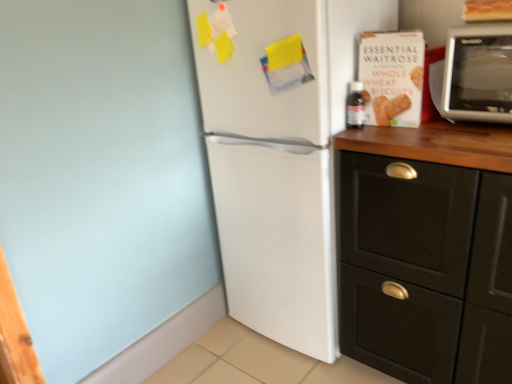
From the picture: What is the approximate width of silver metallic microwave at upper right?

It is 43.12 centimeters.

Where is `white matte refrigerator at center`? white matte refrigerator at center is located at coordinates (279, 159).

How distant is silver metallic microwave at upper right from white matte refrigerator at center?

A distance of 21.13 inches exists between silver metallic microwave at upper right and white matte refrigerator at center.

Is silver metallic microwave at upper right positioned beyond the bounds of white matte refrigerator at center?

Yes, silver metallic microwave at upper right is located beyond the bounds of white matte refrigerator at center.

How different are the orientations of silver metallic microwave at upper right and white matte refrigerator at center in degrees?

2.71 degrees.

Considering the sizes of objects silver metallic microwave at upper right and white matte refrigerator at center in the image provided, who is shorter, silver metallic microwave at upper right or white matte refrigerator at center?

Standing shorter between the two is silver metallic microwave at upper right.

Considering the sizes of objects white matte refrigerator at center and silver metallic microwave at upper right in the image provided, who is taller, white matte refrigerator at center or silver metallic microwave at upper right?

white matte refrigerator at center.

Can you confirm if white matte refrigerator at center is bigger than silver metallic microwave at upper right?

Yes.

Where is `refrigerator below the silver metallic microwave at upper right (from a real-world perspective)`? refrigerator below the silver metallic microwave at upper right (from a real-world perspective) is located at coordinates (279, 159).

From a real-world perspective, is white matte refrigerator at center above or below silver metallic microwave at upper right?

white matte refrigerator at center is situated lower than silver metallic microwave at upper right in the real world.

Is black matte cabinet at right wider than white cardboard box of whole wheat biscuits at upper right?

Yes.

Considering the positions of objects black matte cabinet at right and white cardboard box of whole wheat biscuits at upper right in the image provided, who is in front, black matte cabinet at right or white cardboard box of whole wheat biscuits at upper right?

black matte cabinet at right is in front.

Is white cardboard box of whole wheat biscuits at upper right surrounded by black matte cabinet at right?

No, white cardboard box of whole wheat biscuits at upper right is not a part of black matte cabinet at right.

From a real-world perspective, is black matte cabinet at right located beneath white cardboard box of whole wheat biscuits at upper right?

Yes, from a real-world perspective, black matte cabinet at right is beneath white cardboard box of whole wheat biscuits at upper right.

Does point (414, 69) appear closer or farther from the camera than point (479, 93)?

Point (414, 69) is positioned farther from the camera compared to point (479, 93).

Which of these two, white cardboard box of whole wheat biscuits at upper right or silver metallic microwave at upper right, is bigger?

silver metallic microwave at upper right is bigger.

From the image's perspective, which one is positioned lower, white cardboard box of whole wheat biscuits at upper right or silver metallic microwave at upper right?

white cardboard box of whole wheat biscuits at upper right, from the image's perspective.

Which object is more forward, white cardboard box of whole wheat biscuits at upper right or silver metallic microwave at upper right?

silver metallic microwave at upper right.

Is black matte cabinet at right turned away from white matte refrigerator at center?

No, black matte cabinet at right is not facing the opposite direction of white matte refrigerator at center.

From the image's perspective, who appears lower, black matte cabinet at right or white matte refrigerator at center?

black matte cabinet at right.

From the picture: Which object is wider, black matte cabinet at right or white matte refrigerator at center?

white matte refrigerator at center.

Is black matte cabinet at right outside of white matte refrigerator at center?

That's correct, black matte cabinet at right is outside of white matte refrigerator at center.

Is silver metallic microwave at upper right in contact with white cardboard box of whole wheat biscuits at upper right?

No, silver metallic microwave at upper right is not making contact with white cardboard box of whole wheat biscuits at upper right.

Between silver metallic microwave at upper right and white cardboard box of whole wheat biscuits at upper right, which one appears on the left side from the viewer's perspective?

Positioned to the left is white cardboard box of whole wheat biscuits at upper right.

Is silver metallic microwave at upper right situated inside white cardboard box of whole wheat biscuits at upper right or outside?

silver metallic microwave at upper right is spatially situated outside white cardboard box of whole wheat biscuits at upper right.

Considering the sizes of objects silver metallic microwave at upper right and white cardboard box of whole wheat biscuits at upper right in the image provided, who is taller, silver metallic microwave at upper right or white cardboard box of whole wheat biscuits at upper right?

With more height is silver metallic microwave at upper right.

Which object is thinner, black matte cabinet at right or silver metallic microwave at upper right?

Thinner between the two is silver metallic microwave at upper right.

Between black matte cabinet at right and silver metallic microwave at upper right, which one has less height?

silver metallic microwave at upper right.

Is black matte cabinet at right further to the viewer compared to silver metallic microwave at upper right?

No, it is not.

The width and height of the screenshot is (512, 384). Find the location of `refrigerator located on the left of silver metallic microwave at upper right`. refrigerator located on the left of silver metallic microwave at upper right is located at coordinates (279, 159).

This screenshot has width=512, height=384. I want to click on microwave oven above the white matte refrigerator at center (from a real-world perspective), so click(478, 74).

Looking at the image, which one is located further to white cardboard box of whole wheat biscuits at upper right, white matte refrigerator at center or black matte cabinet at right?

black matte cabinet at right lies further to white cardboard box of whole wheat biscuits at upper right than the other object.

Which object lies further to the anchor point silver metallic microwave at upper right, white matte refrigerator at center or black matte cabinet at right?

Based on the image, white matte refrigerator at center appears to be further to silver metallic microwave at upper right.

Estimate the real-world distances between objects in this image. Which object is further from white cardboard box of whole wheat biscuits at upper right, white matte refrigerator at center or silver metallic microwave at upper right?

white matte refrigerator at center lies further to white cardboard box of whole wheat biscuits at upper right than the other object.

Looking at the image, which one is located closer to black matte cabinet at right, white cardboard box of whole wheat biscuits at upper right or white matte refrigerator at center?

Among the two, white matte refrigerator at center is located nearer to black matte cabinet at right.

When comparing their distances from black matte cabinet at right, does silver metallic microwave at upper right or white cardboard box of whole wheat biscuits at upper right seem further?

Based on the image, silver metallic microwave at upper right appears to be further to black matte cabinet at right.

Considering their positions, is black matte cabinet at right positioned further to white cardboard box of whole wheat biscuits at upper right than silver metallic microwave at upper right?

black matte cabinet at right.

Looking at the image, which one is located closer to black matte cabinet at right, white matte refrigerator at center or silver metallic microwave at upper right?

white matte refrigerator at center is closer to black matte cabinet at right.

Based on the photo, based on their spatial positions, is black matte cabinet at right or white cardboard box of whole wheat biscuits at upper right closer to silver metallic microwave at upper right?

white cardboard box of whole wheat biscuits at upper right.

I want to click on refrigerator between silver metallic microwave at upper right and black matte cabinet at right vertically, so click(279, 159).

The width and height of the screenshot is (512, 384). I want to click on refrigerator between white cardboard box of whole wheat biscuits at upper right and black matte cabinet at right vertically, so click(x=279, y=159).

I want to click on magazine between silver metallic microwave at upper right and black matte cabinet at right in the vertical direction, so click(x=392, y=76).

Identify the location of magazine between white matte refrigerator at center and silver metallic microwave at upper right in the horizontal direction. (392, 76).